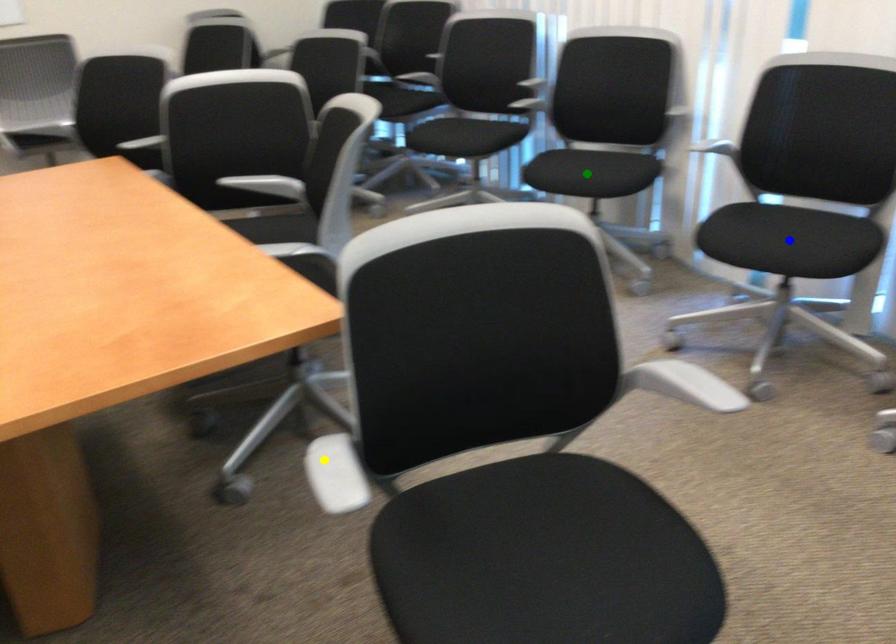
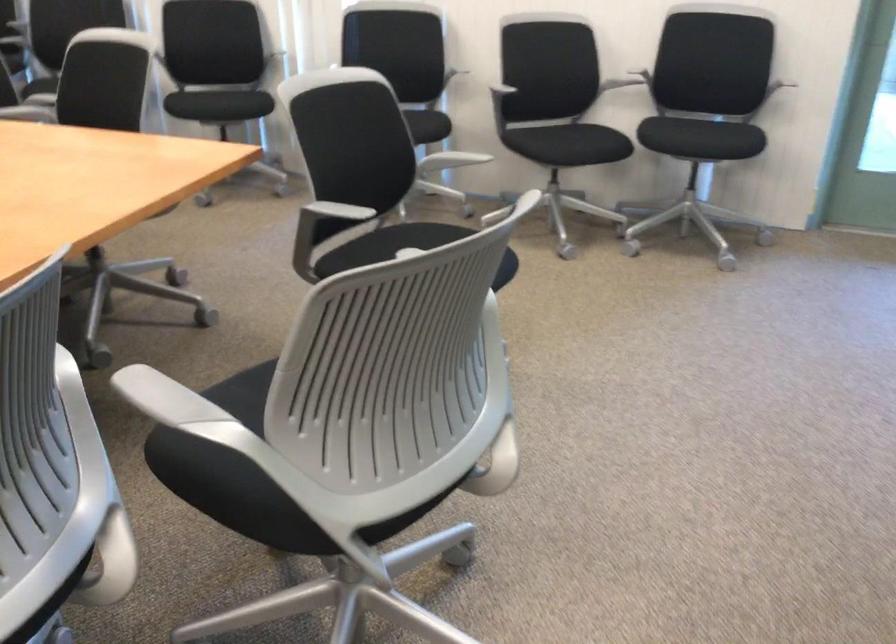
I am providing you with two images of the same scene from different viewpoints. Three points are marked in image1. Which point corresponds to a part or object that is occluded in image2?In image1, three points are marked. Which of them correspond to a part or object that is occluded in image2?Among the three points shown in image1, which one corresponds to a part or object that is no longer visible due to occlusion in image2?

blue point, green point cannot be seen in image2.